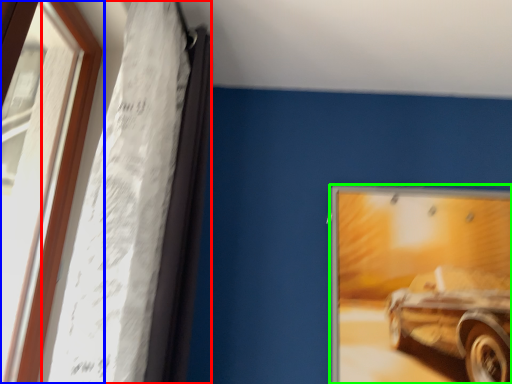
Question: Estimate the real-world distances between objects in this image. Which object is closer to curtain (highlighted by a red box), window (highlighted by a blue box) or picture frame (highlighted by a green box)?

Choices:
 (A) window
 (B) picture frame

Answer: (A)